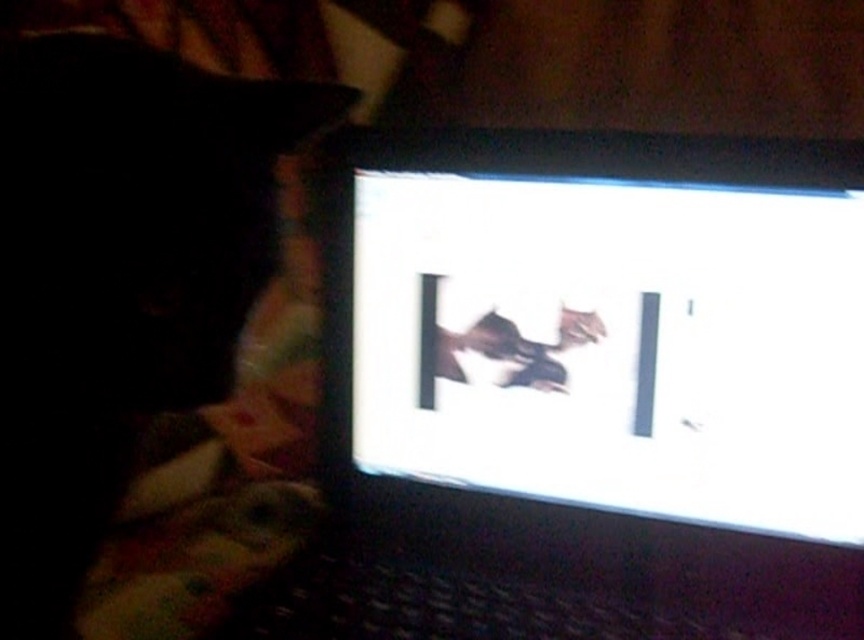
You are standing in the dimly lit room facing the laptop screen. There are two points marked on the screen at coordinates point (567, 248) and point (169, 284). Which point is closer to your eyes?

Point (567, 248) is further to the camera than point (169, 284), so the point closer to your eyes is point (169, 284).

You are setting up a desk for a presentation and need to arrange two matte black laptops. The matte black laptop at center and the matte black laptop at upper right are both on the desk. Which one should you place closer to the edge to ensure stability, considering their heights?

The matte black laptop at upper right should be placed closer to the edge because it is shorter than the matte black laptop at center, making it less stable on its own.

Based on the photo, you are standing in the room and want to touch both the matte black laptop at center and the matte black laptop at upper right. Which one would you reach first?

You would reach the matte black laptop at center first because it is closer to you than the matte black laptop at upper right, which is further away.